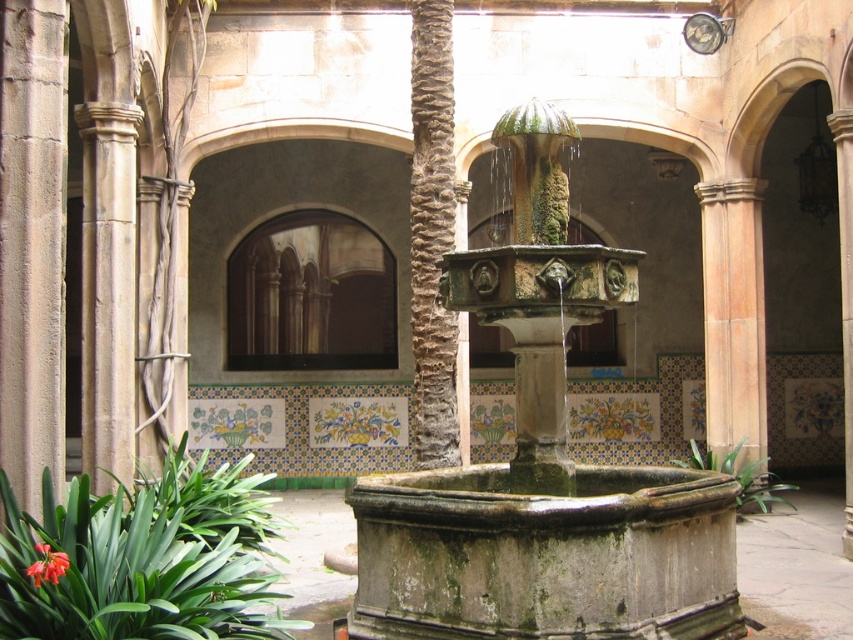
Between point (508, 301) and point (54, 563), which one is positioned in front?

Point (54, 563) is in front.

Identify the location of green mossy stone fountain at center. The image size is (853, 640). (543, 467).

Can you confirm if green mossy stone fountain at center is shorter than rough textured stone pillar at center?

Yes.

Which is behind, point (677, 524) or point (416, 330)?

Point (416, 330)

You are a GUI agent. You are given a task and a screenshot of the screen. Output one action in this format:
    pyautogui.click(x=<x>, y=<y>)
    Task: Click on the green mossy stone fountain at center
    
    Given the screenshot: What is the action you would take?
    pyautogui.click(x=543, y=467)

Is rough textured stone pillar at center thinner than bright red petal at lower left?

Incorrect, rough textured stone pillar at center's width is not less than bright red petal at lower left's.

Measure the distance between point (410,22) and camera.

They are 21.03 meters apart.

Identify the location of rough textured stone pillar at center. The image size is (853, 640). (432, 236).